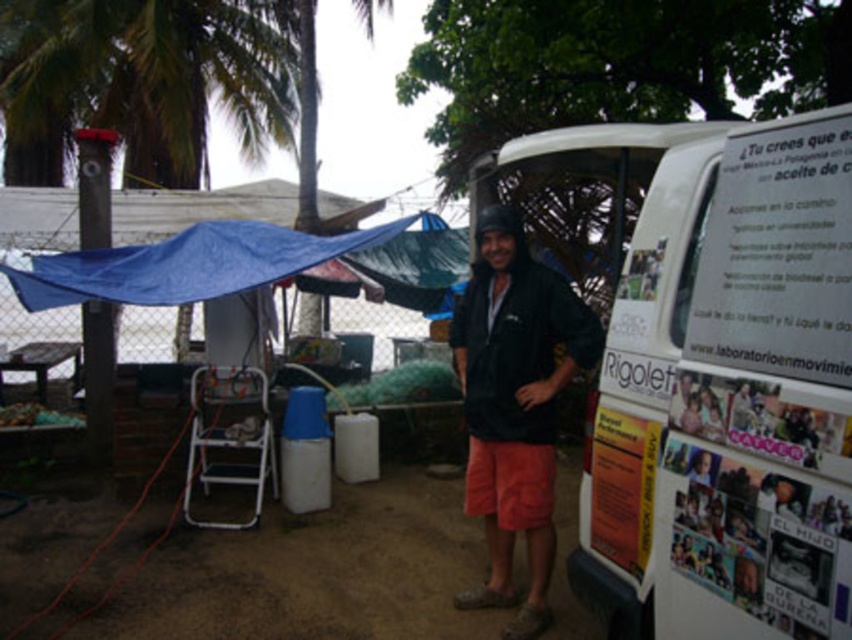
Question: In this image, where is black matte jacket at center located relative to blue tarp at upper left?

Choices:
 (A) left
 (B) right

Answer: (B)

Question: Does white glossy van at center have a smaller size compared to black matte jacket at center?

Choices:
 (A) no
 (B) yes

Answer: (A)

Question: Which object is farther from the camera taking this photo?

Choices:
 (A) black matte jacket at center
 (B) blue tarp at upper left

Answer: (B)

Question: Is white glossy van at center to the left of green leafy palm tree at upper left from the viewer's perspective?

Choices:
 (A) yes
 (B) no

Answer: (B)

Question: Which object is the closest to the blue tarp at upper left?

Choices:
 (A) white glossy van at center
 (B) black matte jacket at center

Answer: (B)

Question: Which of the following is the farthest from the observer?

Choices:
 (A) (73, 260)
 (B) (95, 113)

Answer: (B)